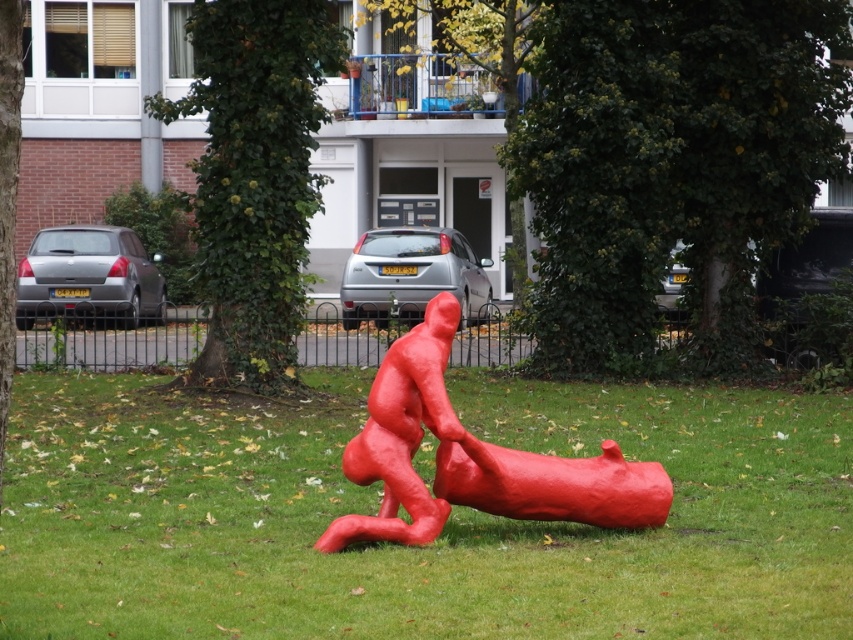
Which is below, green grass at center or matte red figure at center?

green grass at center is lower down.

From the picture: Is the position of green grass at center more distant than that of matte red figure at center?

No.

Who is more distant from viewer, (584, 552) or (438, 358)?

The point (584, 552) is more distant.

The width and height of the screenshot is (853, 640). What are the coordinates of `green grass at center` in the screenshot? It's located at (444, 525).